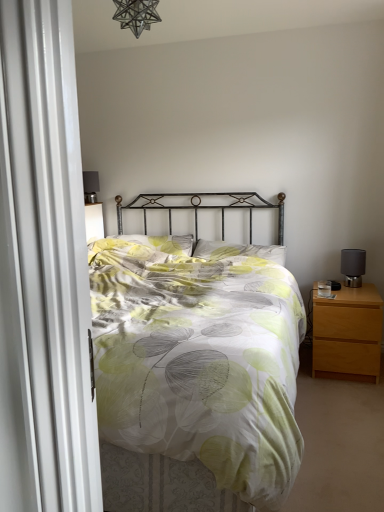
Question: Is metallic star-shaped light fixture at upper center completely or partially inside white fabric pillow at center, which is the first pillow from right to left?

Choices:
 (A) yes
 (B) no

Answer: (B)

Question: Is white fabric pillow at center, acting as the 2th pillow starting from the left, further to the viewer compared to metallic star-shaped light fixture at upper center?

Choices:
 (A) no
 (B) yes

Answer: (B)

Question: Is white fabric pillow at center, which is the first pillow from right to left, oriented towards metallic star-shaped light fixture at upper center?

Choices:
 (A) no
 (B) yes

Answer: (A)

Question: Is there a large distance between white fabric pillow at center, which is the first pillow from right to left, and metallic star-shaped light fixture at upper center?

Choices:
 (A) no
 (B) yes

Answer: (B)

Question: From the image's perspective, is white fabric pillow at center, which is the first pillow from right to left, on top of metallic star-shaped light fixture at upper center?

Choices:
 (A) no
 (B) yes

Answer: (A)

Question: From the image's perspective, is white fabric pillow at center, which is the first pillow from right to left, positioned above or below light green fabric pillow at center, the first pillow when ordered from left to right?

Choices:
 (A) below
 (B) above

Answer: (A)

Question: Relative to light green fabric pillow at center, the first pillow when ordered from left to right, is white fabric pillow at center, which is the first pillow from right to left, in front or behind?

Choices:
 (A) front
 (B) behind

Answer: (A)

Question: Based on their positions, is white fabric pillow at center, acting as the 2th pillow starting from the left, located to the left or right of light green fabric pillow at center, the first pillow when ordered from left to right?

Choices:
 (A) right
 (B) left

Answer: (A)

Question: Does point (210, 256) appear closer or farther from the camera than point (170, 246)?

Choices:
 (A) closer
 (B) farther

Answer: (A)

Question: Would you say light brown wood nightstand at right is inside or outside printed fabric bed at center?

Choices:
 (A) outside
 (B) inside

Answer: (A)

Question: From a real-world perspective, relative to printed fabric bed at center, is light brown wood nightstand at right vertically above or below?

Choices:
 (A) above
 (B) below

Answer: (B)

Question: Considering the positions of point (372, 300) and point (183, 412), is point (372, 300) closer or farther from the camera than point (183, 412)?

Choices:
 (A) closer
 (B) farther

Answer: (B)

Question: In terms of height, does light brown wood nightstand at right look taller or shorter compared to printed fabric bed at center?

Choices:
 (A) tall
 (B) short

Answer: (B)

Question: Considering the positions of matte black table lamp at right and light green fabric pillow at center, which is counted as the 2th pillow, starting from the right, in the image, is matte black table lamp at right wider or thinner than light green fabric pillow at center, which is counted as the 2th pillow, starting from the right,?

Choices:
 (A) thin
 (B) wide

Answer: (A)

Question: From the image's perspective, is matte black table lamp at right above or below light green fabric pillow at center, which is counted as the 2th pillow, starting from the right?

Choices:
 (A) below
 (B) above

Answer: (A)